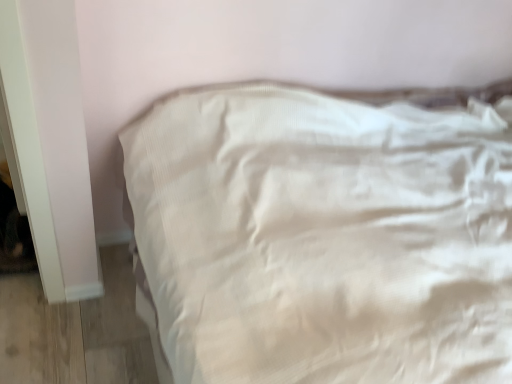
Question: Should I look upward or downward to see white fabric bed at center?

Choices:
 (A) down
 (B) up

Answer: (A)